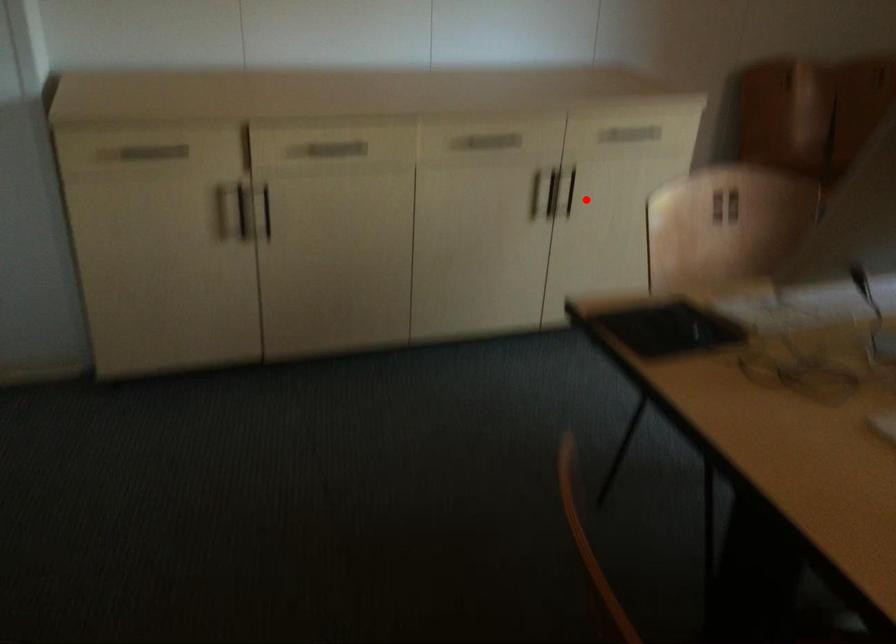
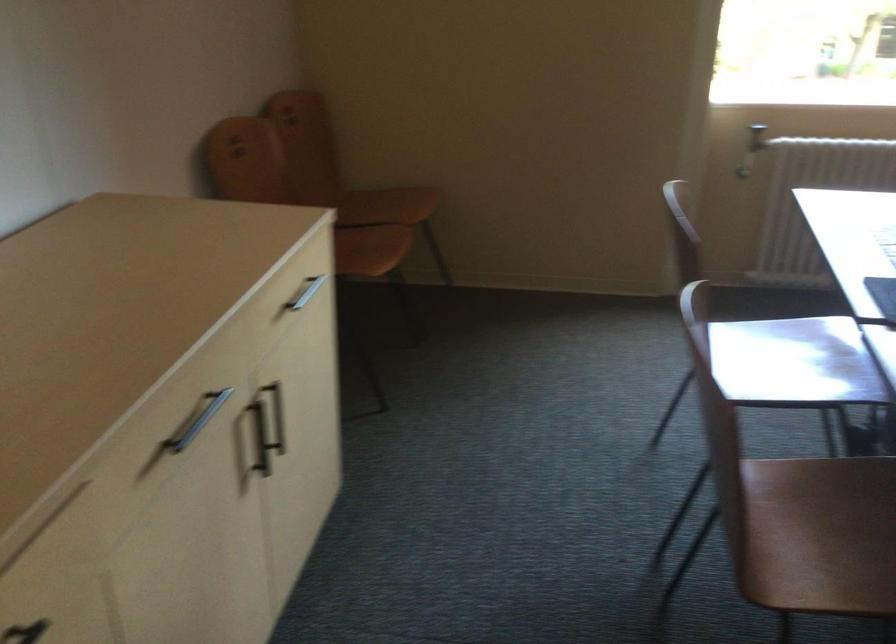
Question: I am providing you with two images of the same scene from different viewpoints. Given a red point in image1, look at the same physical point in image2. Is it:

Choices:
 (A) Closer to the viewpoint
 (B) Farther from the viewpoint

Answer: (A)